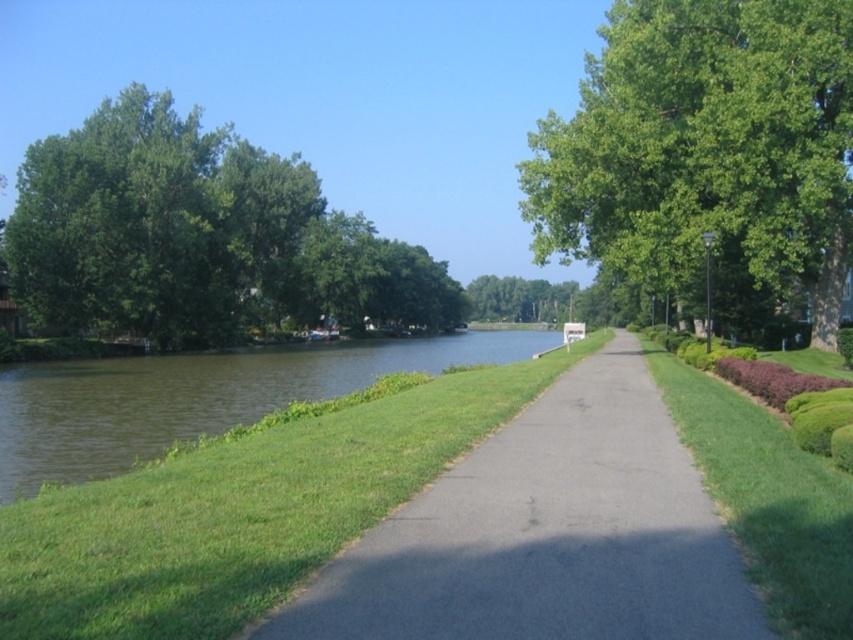
Question: Which object appears closest to the camera in this image?

Choices:
 (A) gray asphalt path at center
 (B) green leafy tree at center
 (C) green leafy tree at upper right

Answer: (A)

Question: Which object is positioned closest to the green grass at center?

Choices:
 (A) green leafy tree at center
 (B) green leafy tree at upper right
 (C) gray asphalt path at center
 (D) green leafy tree at upper left

Answer: (C)

Question: Can you confirm if green leafy tree at upper right is positioned above green leafy tree at upper left?

Choices:
 (A) yes
 (B) no

Answer: (B)

Question: Does green leafy tree at upper right lie behind green leafy tree at upper left?

Choices:
 (A) yes
 (B) no

Answer: (B)

Question: Estimate the real-world distances between objects in this image. Which object is closer to the green leafy tree at upper left?

Choices:
 (A) gray asphalt path at center
 (B) green leafy tree at center
 (C) green leafy tree at upper right

Answer: (B)

Question: Can you confirm if green leafy tree at upper right is positioned to the right of green grass at center?

Choices:
 (A) no
 (B) yes

Answer: (B)